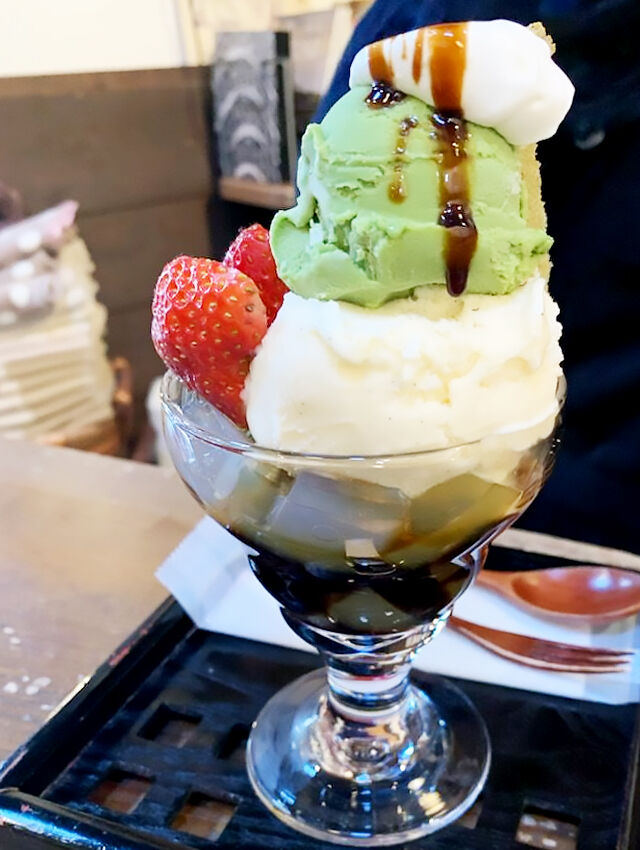
Locate an element on the screen. This screenshot has width=640, height=850. wall dicor is located at coordinates (262, 88).